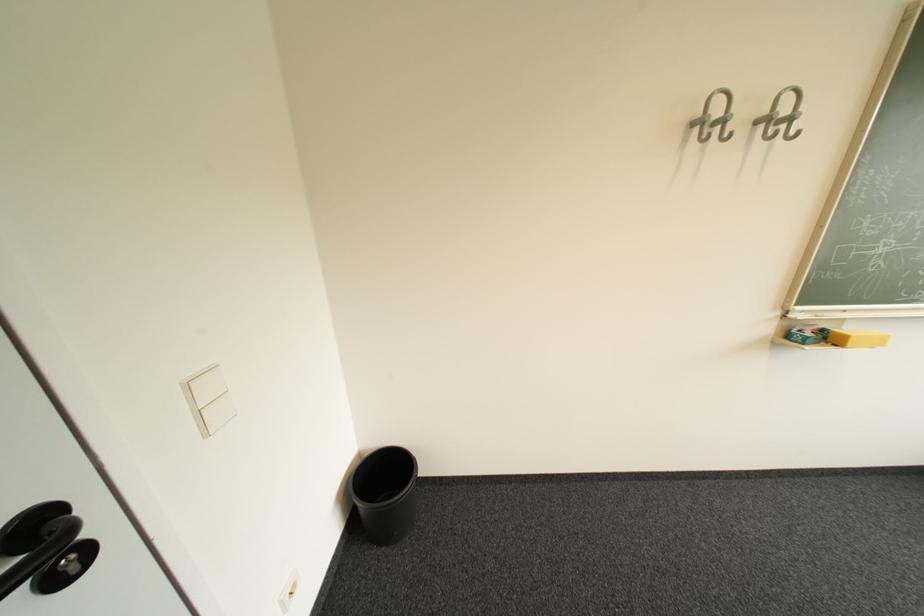
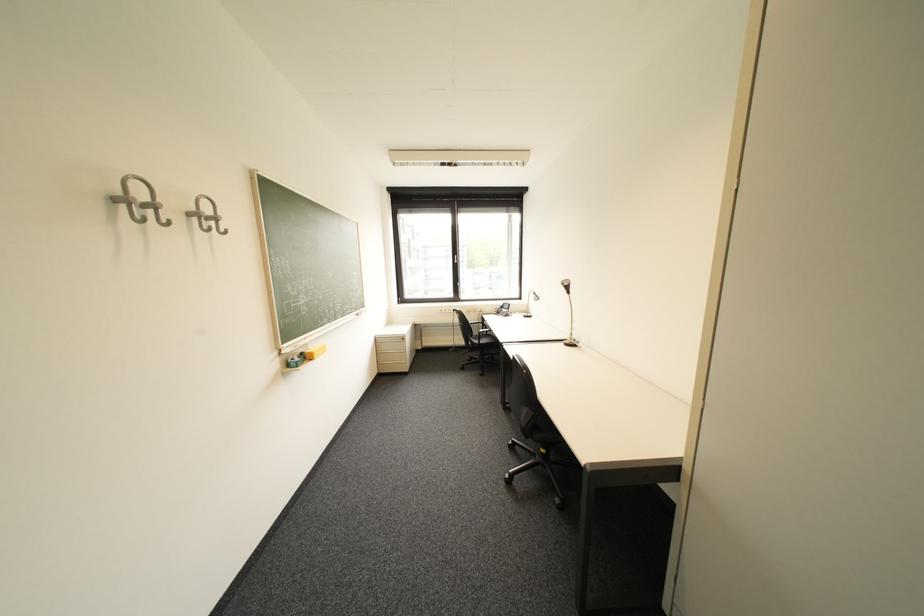
In the second image, find the point that corresponds to [772,127] in the first image.

(205, 220)